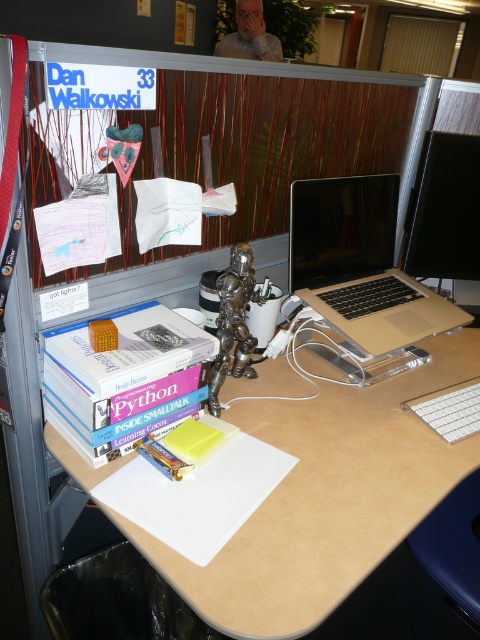
Is gold metallic laptop at upper right below bronze metallic figurine at center?

Actually, gold metallic laptop at upper right is above bronze metallic figurine at center.

Where is `gold metallic laptop at upper right`? gold metallic laptop at upper right is located at coordinates (360, 264).

Locate an element on the screen. The image size is (480, 640). gold metallic laptop at upper right is located at coordinates (360, 264).

Can you confirm if bronze metallic figurine at center is positioned below white plastic keyboard at lower right?

Actually, bronze metallic figurine at center is above white plastic keyboard at lower right.

Is bronze metallic figurine at center wider than white plastic keyboard at lower right?

No.

Between point (254, 284) and point (462, 396), which one is positioned behind?

Point (462, 396)

Where is `bronze metallic figurine at center`? This screenshot has width=480, height=640. bronze metallic figurine at center is located at coordinates (233, 323).

Does gold metallic laptop at upper right appear on the right side of white plastic keyboard at lower right?

Incorrect, gold metallic laptop at upper right is not on the right side of white plastic keyboard at lower right.

In order to click on gold metallic laptop at upper right in this screenshot , I will do [360, 264].

Who is more forward, (x=300, y=250) or (x=427, y=420)?

Positioned in front is point (x=427, y=420).

Where is `gold metallic laptop at upper right`? The height and width of the screenshot is (640, 480). gold metallic laptop at upper right is located at coordinates (360, 264).